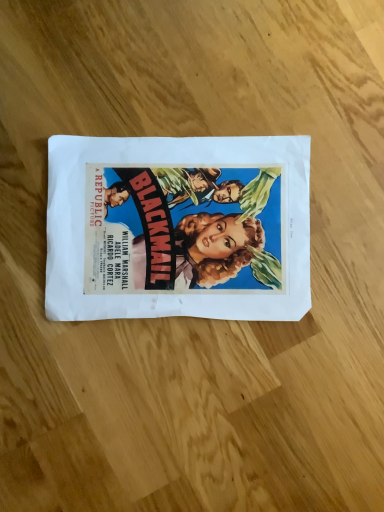
The height and width of the screenshot is (512, 384). What do you see at coordinates (178, 228) in the screenshot? I see `matte paper poster at center` at bounding box center [178, 228].

Locate an element on the screen. The width and height of the screenshot is (384, 512). matte paper poster at center is located at coordinates (178, 228).

The height and width of the screenshot is (512, 384). I want to click on matte paper poster at center, so click(178, 228).